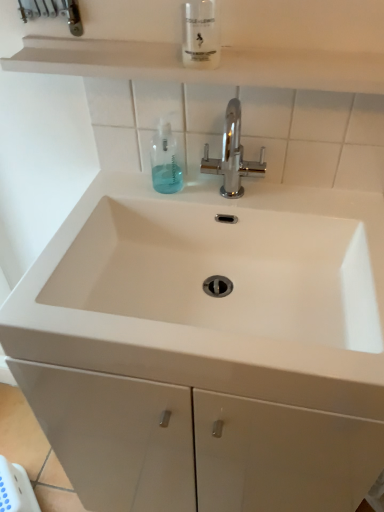
Locate an element on the screen. free space above white matte shelf at upper center (from a real-world perspective) is located at coordinates (180, 46).